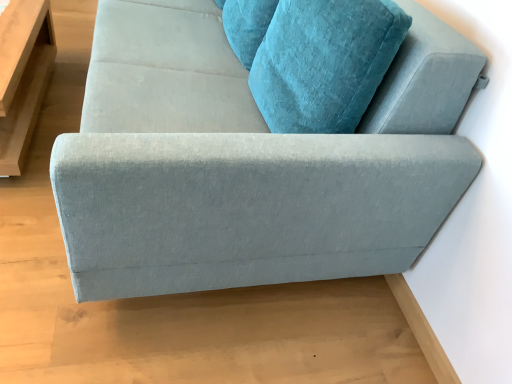
Question: Is matte gray couch at center positioned with its back to light brown wooden table at left?

Choices:
 (A) yes
 (B) no

Answer: (B)

Question: From the image's perspective, is matte gray couch at center located beneath light brown wooden table at left?

Choices:
 (A) no
 (B) yes

Answer: (A)

Question: Is matte gray couch at center closer to camera compared to light brown wooden table at left?

Choices:
 (A) yes
 (B) no

Answer: (A)

Question: Are matte gray couch at center and light brown wooden table at left making contact?

Choices:
 (A) yes
 (B) no

Answer: (B)

Question: From the image's perspective, is matte gray couch at center over light brown wooden table at left?

Choices:
 (A) yes
 (B) no

Answer: (A)

Question: Would you consider matte gray couch at center to be distant from light brown wooden table at left?

Choices:
 (A) yes
 (B) no

Answer: (A)

Question: Considering the relative positions of light brown wooden table at left and matte gray couch at center in the image provided, is light brown wooden table at left to the left of matte gray couch at center from the viewer's perspective?

Choices:
 (A) no
 (B) yes

Answer: (B)

Question: From the image's perspective, is light brown wooden table at left on matte gray couch at center?

Choices:
 (A) no
 (B) yes

Answer: (A)

Question: Is light brown wooden table at left touching matte gray couch at center?

Choices:
 (A) no
 (B) yes

Answer: (A)

Question: From a real-world perspective, is light brown wooden table at left positioned under matte gray couch at center based on gravity?

Choices:
 (A) yes
 (B) no

Answer: (A)

Question: Is light brown wooden table at left wider than matte gray couch at center?

Choices:
 (A) yes
 (B) no

Answer: (B)

Question: Could matte gray couch at center be considered to be inside light brown wooden table at left?

Choices:
 (A) yes
 (B) no

Answer: (B)

Question: Is point (10, 87) positioned closer to the camera than point (364, 170)?

Choices:
 (A) farther
 (B) closer

Answer: (A)